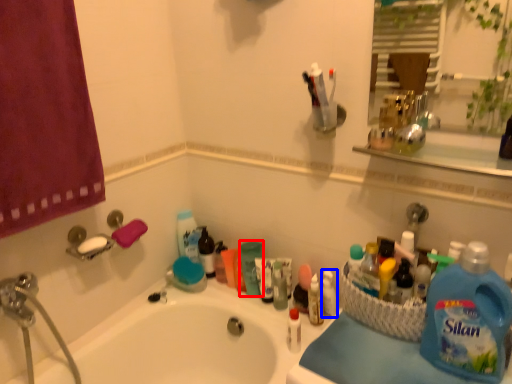
Question: Which object appears farthest to the camera in this image, cleaning product (highlighted by a red box) or toiletry (highlighted by a blue box)?

Choices:
 (A) cleaning product
 (B) toiletry

Answer: (A)